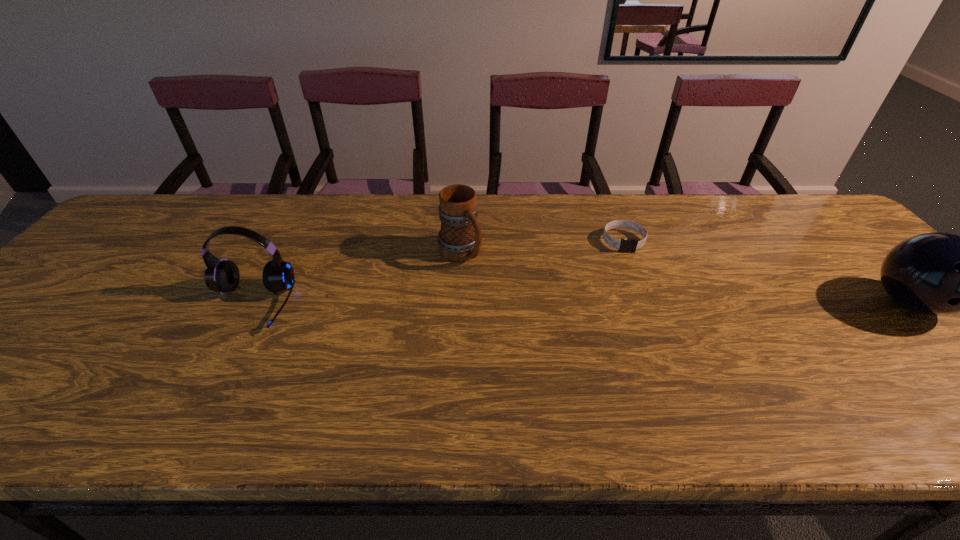
Image resolution: width=960 pixels, height=540 pixels. Identify the location of vacant space that is in between the third object from right to left and the wristband. (541, 247).

Identify the location of empty space that is in between the headset and the second object from right to left. (437, 273).

At what (x,y) coordinates should I click in order to perform the action: click on the closest object to the wristband. Please return your answer as a coordinate pair (x, y). The width and height of the screenshot is (960, 540). Looking at the image, I should click on (460, 238).

Identify which object is located as the second nearest to the second object from left to right. Please provide its 2D coordinates. Your answer should be formatted as a tuple, i.e. [(x, y)], where the tuple contains the x and y coordinates of a point satisfying the conditions above.

[(625, 245)]